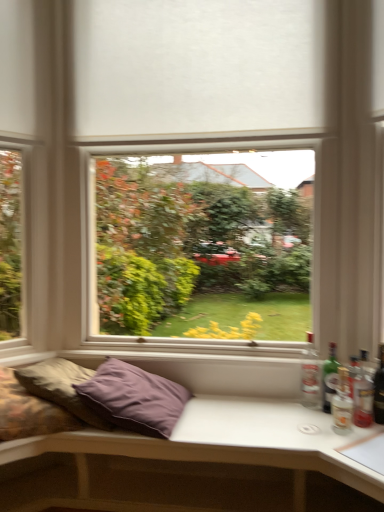
The height and width of the screenshot is (512, 384). What are the coordinates of `vacant space positioned to the left of translucent glass beer bottle at right` in the screenshot? It's located at (338, 425).